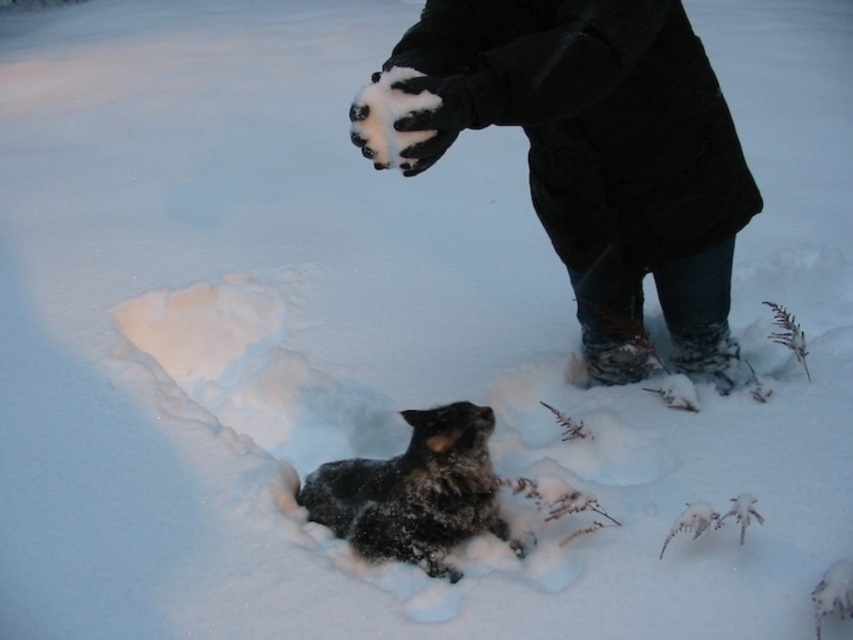
Question: Is black woolen coat at upper center to the left of fuzzy black dog at lower center from the viewer's perspective?

Choices:
 (A) no
 (B) yes

Answer: (A)

Question: Does black woolen coat at upper center have a larger size compared to fuzzy black dog at lower center?

Choices:
 (A) yes
 (B) no

Answer: (A)

Question: Which point appears closest to the camera in this image?

Choices:
 (A) (494, 476)
 (B) (672, 141)

Answer: (B)

Question: Which point is closer to the camera taking this photo?

Choices:
 (A) (689, 154)
 (B) (331, 508)

Answer: (A)

Question: Is black woolen coat at upper center to the right of fuzzy black dog at lower center from the viewer's perspective?

Choices:
 (A) no
 (B) yes

Answer: (B)